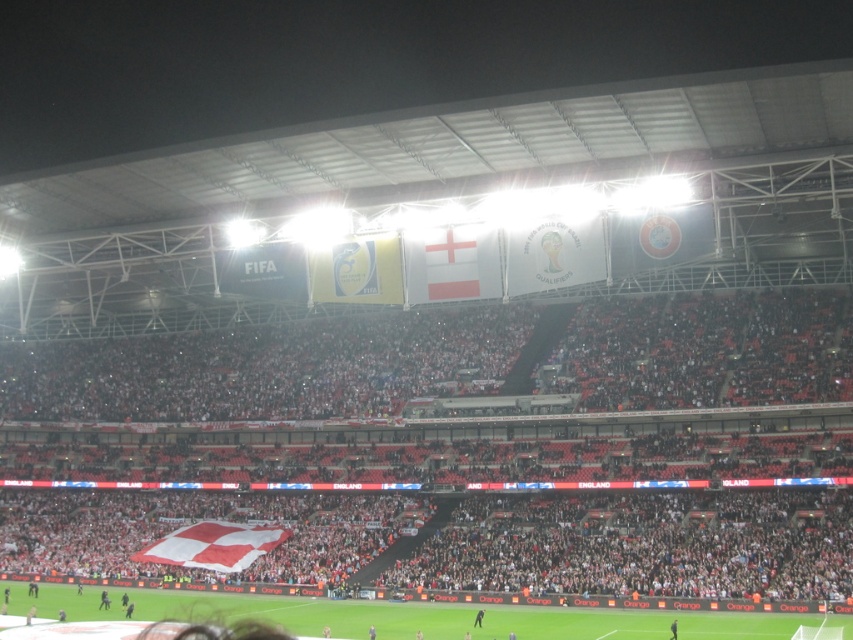
Can you confirm if white fabric crowd at center is shorter than smooth black suit at center?

Incorrect, white fabric crowd at center's height does not fall short of smooth black suit at center's.

Does white fabric crowd at center have a lesser width compared to smooth black suit at center?

In fact, white fabric crowd at center might be wider than smooth black suit at center.

Locate an element on the screen. The width and height of the screenshot is (853, 640). white fabric crowd at center is located at coordinates (262, 369).

You are a GUI agent. You are given a task and a screenshot of the screen. Output one action in this format:
    pyautogui.click(x=<x>, y=<y>)
    Task: Click on the white fabric crowd at center
    
    Given the screenshot: What is the action you would take?
    pyautogui.click(x=262, y=369)